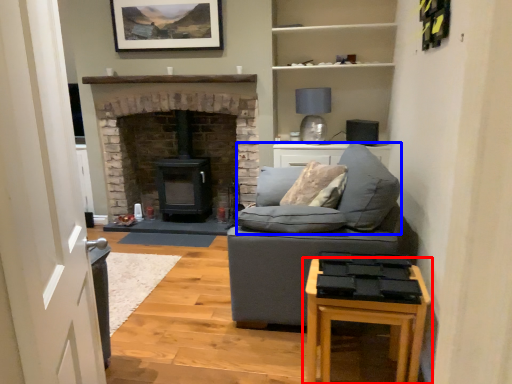
Question: Which object is further to the camera taking this photo, table (highlighted by a red box) or sit (highlighted by a blue box)?

Choices:
 (A) table
 (B) sit

Answer: (B)